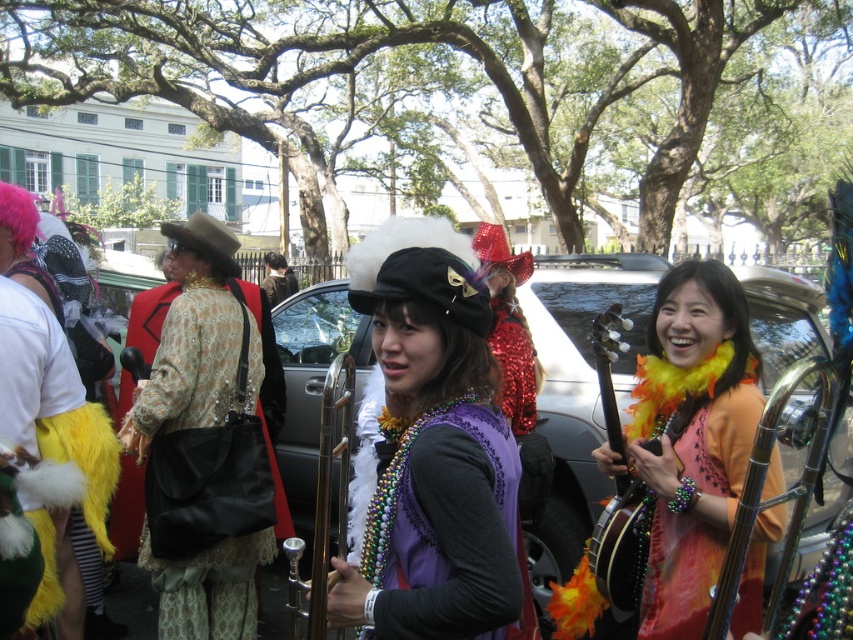
Between point (248, 445) and point (608, 557), which one is positioned in front?

Point (608, 557) is more forward.

Consider the image. Between matte gold jacket at center and wooden banjo at center, which one appears on the left side from the viewer's perspective?

matte gold jacket at center

Does point (218, 444) come behind point (604, 556)?

Yes, point (218, 444) is behind point (604, 556).

I want to click on matte gold jacket at center, so click(204, 448).

Between shiny sequin dress at center and matte gold jacket at center, which one is positioned higher?

shiny sequin dress at center is higher up.

Does shiny sequin dress at center come in front of matte gold jacket at center?

Yes, it is.

Who is more distant from viewer, (561, 262) or (183, 621)?

The point (561, 262) is more distant.

Find the location of a particular element. The image size is (853, 640). shiny sequin dress at center is located at coordinates (578, 392).

Between point (440, 400) and point (163, 344), which one is positioned in front?

Point (440, 400) is in front.

Does purple velvet vest at center appear over matte gold jacket at center?

Yes, purple velvet vest at center is above matte gold jacket at center.

Is point (461, 595) in front of point (173, 259)?

Yes, point (461, 595) is in front of point (173, 259).

Find the location of a particular element. purple velvet vest at center is located at coordinates (434, 465).